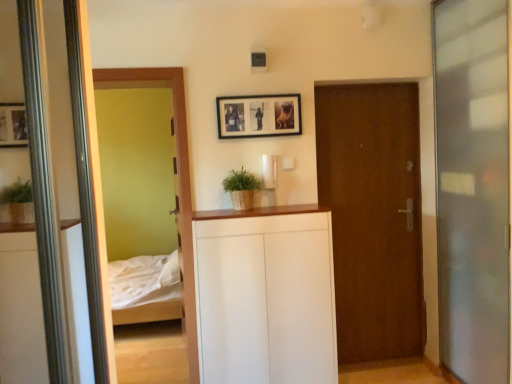
Question: Is white matte cabinet at center bigger than braided straw plant at center?

Choices:
 (A) yes
 (B) no

Answer: (A)

Question: Would you say white matte cabinet at center contains braided straw plant at center?

Choices:
 (A) yes
 (B) no

Answer: (B)

Question: From a real-world perspective, is white matte cabinet at center beneath braided straw plant at center?

Choices:
 (A) yes
 (B) no

Answer: (A)

Question: Can you confirm if white matte cabinet at center is positioned to the left of braided straw plant at center?

Choices:
 (A) no
 (B) yes

Answer: (A)

Question: Considering the relative sizes of white matte cabinet at center and braided straw plant at center in the image provided, is white matte cabinet at center taller than braided straw plant at center?

Choices:
 (A) yes
 (B) no

Answer: (A)

Question: From a real-world perspective, is black matte picture frame at upper center physically located above or below brown wooden door at center?

Choices:
 (A) below
 (B) above

Answer: (B)

Question: In the image, is black matte picture frame at upper center on the left side or the right side of brown wooden door at center?

Choices:
 (A) left
 (B) right

Answer: (A)

Question: Is black matte picture frame at upper center wider or thinner than brown wooden door at center?

Choices:
 (A) wide
 (B) thin

Answer: (B)

Question: Does point (251, 122) appear closer or farther from the camera than point (371, 306)?

Choices:
 (A) closer
 (B) farther

Answer: (A)

Question: In the image, is brown wooden door at center positioned in front of or behind transparent glass screen door at right?

Choices:
 (A) front
 (B) behind

Answer: (B)

Question: Is brown wooden door at center to the left or to the right of transparent glass screen door at right in the image?

Choices:
 (A) left
 (B) right

Answer: (A)

Question: Looking at their shapes, would you say brown wooden door at center is wider or thinner than transparent glass screen door at right?

Choices:
 (A) thin
 (B) wide

Answer: (A)

Question: Based on their sizes in the image, would you say brown wooden door at center is bigger or smaller than transparent glass screen door at right?

Choices:
 (A) small
 (B) big

Answer: (A)

Question: Would you say brown wooden door at center is inside or outside black matte picture frame at upper center?

Choices:
 (A) outside
 (B) inside

Answer: (A)

Question: Is brown wooden door at center bigger or smaller than black matte picture frame at upper center?

Choices:
 (A) big
 (B) small

Answer: (A)